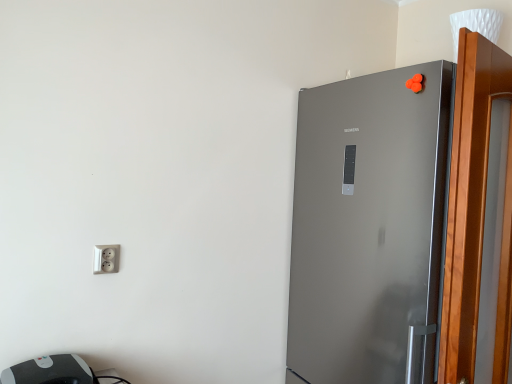
Question: Is satin silver refrigerator at right oriented towards silver metallic socket at lower left?

Choices:
 (A) yes
 (B) no

Answer: (A)

Question: Is satin silver refrigerator at right wider than silver metallic socket at lower left?

Choices:
 (A) yes
 (B) no

Answer: (A)

Question: From the image's perspective, is satin silver refrigerator at right on top of silver metallic socket at lower left?

Choices:
 (A) no
 (B) yes

Answer: (A)

Question: From a real-world perspective, is satin silver refrigerator at right on top of silver metallic socket at lower left?

Choices:
 (A) yes
 (B) no

Answer: (B)

Question: Considering the relative sizes of satin silver refrigerator at right and silver metallic socket at lower left in the image provided, is satin silver refrigerator at right bigger than silver metallic socket at lower left?

Choices:
 (A) yes
 (B) no

Answer: (A)

Question: Is satin silver refrigerator at right taller than silver metallic socket at lower left?

Choices:
 (A) no
 (B) yes

Answer: (B)

Question: Is satin silver refrigerator at right oriented away from gray plastic printer at lower left?

Choices:
 (A) no
 (B) yes

Answer: (A)

Question: Is satin silver refrigerator at right to the right of gray plastic printer at lower left from the viewer's perspective?

Choices:
 (A) no
 (B) yes

Answer: (B)

Question: Considering the relative sizes of satin silver refrigerator at right and gray plastic printer at lower left in the image provided, is satin silver refrigerator at right taller than gray plastic printer at lower left?

Choices:
 (A) no
 (B) yes

Answer: (B)

Question: Is satin silver refrigerator at right outside gray plastic printer at lower left?

Choices:
 (A) yes
 (B) no

Answer: (A)

Question: Is satin silver refrigerator at right to the left of gray plastic printer at lower left from the viewer's perspective?

Choices:
 (A) no
 (B) yes

Answer: (A)

Question: From a real-world perspective, is satin silver refrigerator at right positioned over gray plastic printer at lower left based on gravity?

Choices:
 (A) yes
 (B) no

Answer: (A)

Question: Is satin silver refrigerator at right at the left side of wooden screen door at right?

Choices:
 (A) no
 (B) yes

Answer: (B)